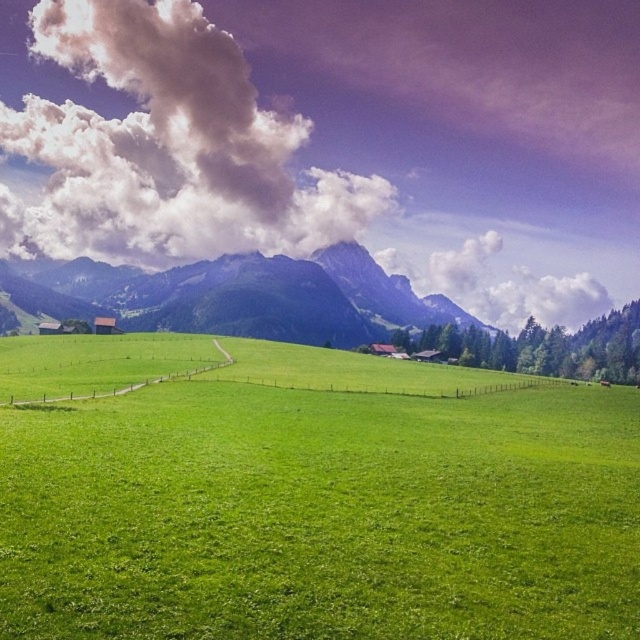
From the picture: Between green grassy field at center and white fluffy cloud at upper center, which one appears on the left side from the viewer's perspective?

From the viewer's perspective, white fluffy cloud at upper center appears more on the left side.

Does green grassy field at center have a greater height compared to white fluffy cloud at upper center?

No, green grassy field at center is not taller than white fluffy cloud at upper center.

Is point (113, 349) farther from viewer compared to point (317, 246)?

No, it is in front of (317, 246).

Identify the location of green grassy field at center. The width and height of the screenshot is (640, 640). (323, 506).